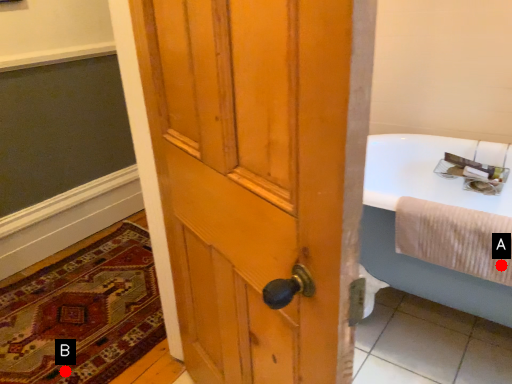
Question: Two points are circled on the image, labeled by A and B beside each circle. Which point is closer to the camera?

Choices:
 (A) A is closer
 (B) B is closer

Answer: (A)